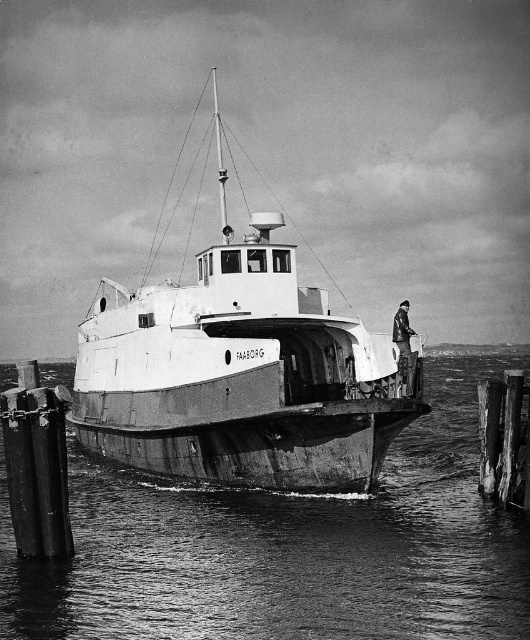
You are standing on the deck of the vintage boat FAABORG and looking towards the pier. You notice two points marked on the image. Which point, point 1 at coordinates (413, 445) or point 2 at coordinates (490, 387), is closer to you?

Point 2 at coordinates (490, 387) is closer to you because point 1 at coordinates (413, 445) is behind it.

You are standing at the front of the vintage boat named FAABORG. You see two points marked on the pier. One is at point (127,371) and the other is at point (407,349). Which point is closer to you?

Point (407,349) is closer to you because point (127,371) is behind it.

You are standing on the pier looking at the smooth water at center and the white matte boat at center. Which object is closer to you from your vantage point on the pier?

The smooth water at center is closer to you because it is positioned in front of the white matte boat at center.